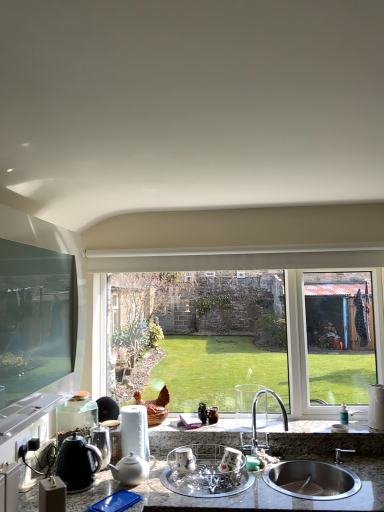
In order to face white glossy teapot at lower center, the 2th tea pot when ordered from left to right, should I rotate leftwards or rightwards?

You should look left and rotate roughly 7.938 degrees.

How much space does clear plastic dish rack at center, arranged as the third appliance when viewed from the back, occupy vertically?

clear plastic dish rack at center, arranged as the third appliance when viewed from the back, is 4.49 inches in height.

In order to click on white ceramic vase at right, which ranks as the 3th appliance in front-to-back order in this screenshot , I will do `click(376, 406)`.

Measure the distance between green glass window at center and camera.

They are 2.41 meters apart.

What do you see at coordinates (102, 443) in the screenshot?
I see `shiny metallic kettle at lower left, positioned as the second appliance in front-to-back order` at bounding box center [102, 443].

In order to face granite gray countertop at lower center, should I rotate leftwards or rightwards?

To face it directly, rotate right by 1.103 degrees.

What are the coordinates of `white glossy teapot at lower center, the 2th tea pot when ordered from left to right` in the screenshot? It's located at (132, 469).

Between white glossy teapot at lower center, the 2th tea pot when ordered from left to right, and clear plastic dish rack at center, the 2th appliance viewed from the right, which one has smaller size?

white glossy teapot at lower center, the 2th tea pot when ordered from left to right, is smaller.

From the image's perspective, is white glossy teapot at lower center, the 2th tea pot when ordered from left to right, on top of clear plastic dish rack at center, placed as the 1th appliance when sorted from front to back?

Yes.

Which of these two, white glossy teapot at lower center, which is the first tea pot in right-to-left order, or clear plastic dish rack at center, arranged as the third appliance when viewed from the back, is wider?

Wider between the two is clear plastic dish rack at center, arranged as the third appliance when viewed from the back.

Could you tell me if clear plastic dish rack at center, the 2th appliance viewed from the right, is facing white ceramic vase at right, which ranks as the 3th appliance in front-to-back order?

No, clear plastic dish rack at center, the 2th appliance viewed from the right, is not aimed at white ceramic vase at right, which ranks as the 3th appliance in front-to-back order.

Which point is more distant from viewer, (190, 481) or (375, 418)?

The point (375, 418) is more distant.

Is white ceramic vase at right, the first appliance from the right, a part of clear plastic dish rack at center, placed as the 1th appliance when sorted from front to back?

Actually, white ceramic vase at right, the first appliance from the right, is outside clear plastic dish rack at center, placed as the 1th appliance when sorted from front to back.

From the image's perspective, which one is positioned higher, clear plastic dish rack at center, the 2th appliance viewed from the right, or white ceramic vase at right, the first appliance from the right?

white ceramic vase at right, the first appliance from the right, from the image's perspective.

Locate an element on the screen. appliance that is the 1st object directly below the white ceramic vase at right, which ranks as the 3th appliance in front-to-back order (from a real-world perspective) is located at coordinates (102, 443).

Considering the positions of points (379, 396) and (110, 460), is point (379, 396) closer to camera compared to point (110, 460)?

No, it is behind (110, 460).

Is white ceramic vase at right, placed as the third appliance when sorted from left to right, spatially inside shiny metallic kettle at lower left, the third appliance from the right, or outside of it?

white ceramic vase at right, placed as the third appliance when sorted from left to right, lies outside shiny metallic kettle at lower left, the third appliance from the right.

Who is bigger, white ceramic vase at right, the 1th appliance from the back, or shiny metallic kettle at lower left, which ranks as the 2th appliance in back-to-front order?

With larger size is white ceramic vase at right, the 1th appliance from the back.

Considering the relative sizes of stainless steel sink at lower right and granite gray countertop at lower center in the image provided, is stainless steel sink at lower right thinner than granite gray countertop at lower center?

Yes, stainless steel sink at lower right is thinner than granite gray countertop at lower center.

From a real-world perspective, is stainless steel sink at lower right physically located above or below granite gray countertop at lower center?

Clearly, from a real-world perspective, stainless steel sink at lower right is above granite gray countertop at lower center.

Which of these two, stainless steel sink at lower right or granite gray countertop at lower center, stands shorter?

stainless steel sink at lower right.

Which point is more forward, [354,485] or [321,430]?

The point [354,485] is closer.

Can you tell me how much shiny metallic kettle at lower left, the 1th appliance positioned from the left, and granite gray countertop at lower center differ in facing direction?

5.09 degrees separate the facing orientations of shiny metallic kettle at lower left, the 1th appliance positioned from the left, and granite gray countertop at lower center.

Who is bigger, shiny metallic kettle at lower left, which ranks as the 2th appliance in back-to-front order, or granite gray countertop at lower center?

With larger size is granite gray countertop at lower center.

Which is in front, shiny metallic kettle at lower left, which ranks as the 2th appliance in back-to-front order, or granite gray countertop at lower center?

granite gray countertop at lower center is in front.

Is shiny metallic kettle at lower left, the 1th appliance positioned from the left, wider than green glass window at center?

No, shiny metallic kettle at lower left, the 1th appliance positioned from the left, is not wider than green glass window at center.

Considering the relative sizes of shiny metallic kettle at lower left, positioned as the second appliance in front-to-back order, and green glass window at center in the image provided, is shiny metallic kettle at lower left, positioned as the second appliance in front-to-back order, shorter than green glass window at center?

Indeed, shiny metallic kettle at lower left, positioned as the second appliance in front-to-back order, has a lesser height compared to green glass window at center.

From the image's perspective, between shiny metallic kettle at lower left, the third appliance from the right, and green glass window at center, which one is located above?

green glass window at center appears higher in the image.

Is shiny metallic kettle at lower left, the 1th appliance positioned from the left, at the right side of green glass window at center?

No.

In the image, is clear plastic dish rack at center, arranged as the third appliance when viewed from the back, on the left side or the right side of black matte tea pot at lower left, positioned as the 1th tea pot in left-to-right order?

clear plastic dish rack at center, arranged as the third appliance when viewed from the back, is to the right of black matte tea pot at lower left, positioned as the 1th tea pot in left-to-right order.

Considering the relative sizes of clear plastic dish rack at center, marked as the 2th appliance in a left-to-right arrangement, and black matte tea pot at lower left, positioned as the 1th tea pot in left-to-right order, in the image provided, is clear plastic dish rack at center, marked as the 2th appliance in a left-to-right arrangement, bigger than black matte tea pot at lower left, positioned as the 1th tea pot in left-to-right order,?

Correct, clear plastic dish rack at center, marked as the 2th appliance in a left-to-right arrangement, is larger in size than black matte tea pot at lower left, positioned as the 1th tea pot in left-to-right order.

Locate an element on the screen. This screenshot has height=512, width=384. the 1st tea pot behind the clear plastic dish rack at center, marked as the 2th appliance in a left-to-right arrangement, starting your count from the anchor is located at coordinates (77, 463).

Is clear plastic dish rack at center, the 2th appliance viewed from the right, looking in the opposite direction of black matte tea pot at lower left, which is the second tea pot in right-to-left order?

No, black matte tea pot at lower left, which is the second tea pot in right-to-left order, is not at the back of clear plastic dish rack at center, the 2th appliance viewed from the right.

There is a clear plastic dish rack at center, marked as the 2th appliance in a left-to-right arrangement. Find the location of `the 1st tea pot above it (from a real-world perspective)`. the 1st tea pot above it (from a real-world perspective) is located at coordinates (132, 469).

This screenshot has height=512, width=384. I want to click on the 2nd appliance in front of the white ceramic vase at right, the 1th appliance from the back, starting your count from the anchor, so click(206, 471).

Which object lies further to the anchor point white glossy teapot at lower center, which is the first tea pot in right-to-left order, black matte tea pot at lower left, positioned as the 1th tea pot in left-to-right order, or granite gray countertop at lower center?

Based on the image, granite gray countertop at lower center appears to be further to white glossy teapot at lower center, which is the first tea pot in right-to-left order.

Based on the photo, which object lies further to the anchor point granite gray countertop at lower center, satin nickel faucet at center or white glossy teapot at lower center, the 2th tea pot when ordered from left to right?

white glossy teapot at lower center, the 2th tea pot when ordered from left to right, is positioned further to the anchor granite gray countertop at lower center.

Which object lies further to the anchor point black matte tea pot at lower left, which is the second tea pot in right-to-left order, clear plastic dish rack at center, arranged as the third appliance when viewed from the back, or satin nickel faucet at center?

Among the two, satin nickel faucet at center is located further to black matte tea pot at lower left, which is the second tea pot in right-to-left order.

Considering their positions, is clear plastic dish rack at center, the 2th appliance viewed from the right, positioned closer to black matte tea pot at lower left, positioned as the 1th tea pot in left-to-right order, than white ceramic vase at right, the first appliance from the right?

clear plastic dish rack at center, the 2th appliance viewed from the right, lies closer to black matte tea pot at lower left, positioned as the 1th tea pot in left-to-right order, than the other object.

Estimate the real-world distances between objects in this image. Which object is closer to black matte tea pot at lower left, positioned as the 1th tea pot in left-to-right order, satin nickel faucet at center or white ceramic vase at right, the 1th appliance from the back?

Among the two, satin nickel faucet at center is located nearer to black matte tea pot at lower left, positioned as the 1th tea pot in left-to-right order.

From the image, which object appears to be farther from black matte tea pot at lower left, which is the second tea pot in right-to-left order, white glossy teapot at lower center, the 2th tea pot when ordered from left to right, or clear plastic dish rack at center, marked as the 2th appliance in a left-to-right arrangement?

Among the two, clear plastic dish rack at center, marked as the 2th appliance in a left-to-right arrangement, is located further to black matte tea pot at lower left, which is the second tea pot in right-to-left order.

Looking at the image, which one is located closer to clear plastic dish rack at center, the 2th appliance viewed from the right, satin nickel faucet at center or granite gray countertop at lower center?

granite gray countertop at lower center is positioned closer to the anchor clear plastic dish rack at center, the 2th appliance viewed from the right.

Looking at the image, which one is located further to shiny metallic kettle at lower left, the 1th appliance positioned from the left, white glossy teapot at lower center, the 2th tea pot when ordered from left to right, or clear plastic dish rack at center, placed as the 1th appliance when sorted from front to back?

clear plastic dish rack at center, placed as the 1th appliance when sorted from front to back, is further to shiny metallic kettle at lower left, the 1th appliance positioned from the left.

At what (x,y) coordinates should I click in order to perform the action: click on sink located between clear plastic dish rack at center, marked as the 2th appliance in a left-to-right arrangement, and white ceramic vase at right, the first appliance from the right, in the left-right direction. Please return your answer as a coordinate pair (x, y). Looking at the image, I should click on (312, 480).

This screenshot has width=384, height=512. What are the coordinates of `tap between granite gray countertop at lower center and white ceramic vase at right, which ranks as the 3th appliance in front-to-back order, from left to right` in the screenshot? It's located at tap(256, 423).

At what (x,y) coordinates should I click in order to perform the action: click on tea pot between black matte tea pot at lower left, positioned as the 1th tea pot in left-to-right order, and stainless steel sink at lower right. Please return your answer as a coordinate pair (x, y). This screenshot has height=512, width=384. Looking at the image, I should click on (132, 469).

Where is `tea pot situated between black matte tea pot at lower left, positioned as the 1th tea pot in left-to-right order, and satin nickel faucet at center from left to right`? The height and width of the screenshot is (512, 384). tea pot situated between black matte tea pot at lower left, positioned as the 1th tea pot in left-to-right order, and satin nickel faucet at center from left to right is located at coordinates (132, 469).